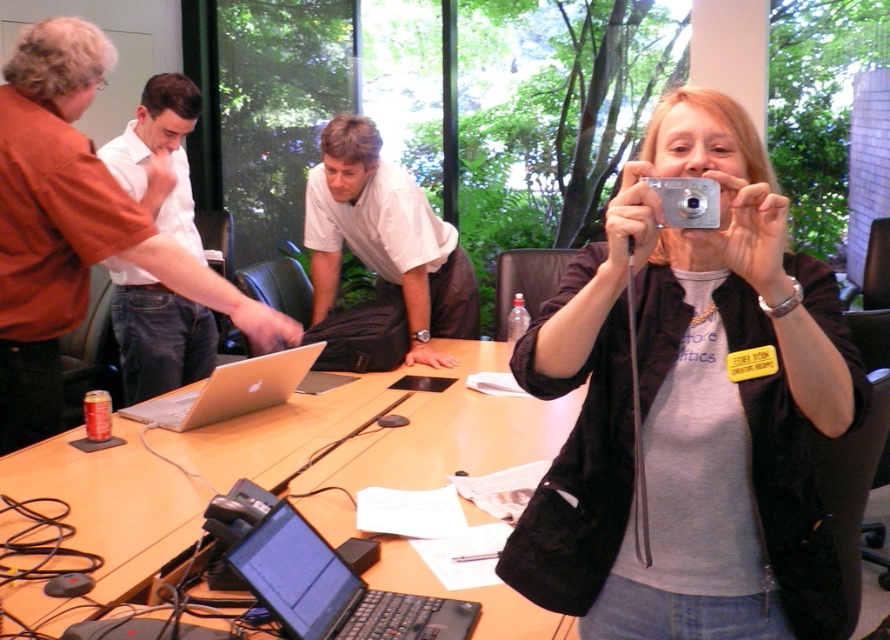
You are standing at the origin point of the coordinate system in this image. The coordinate system has its origin at the bottom left corner of the image. You need to move towards the black plastic laptop at lower center. What direction should you move in to reach it?

The black plastic laptop at lower center is located at point (333, 588). Since the coordinate system has its origin at the bottom left corner, moving towards the right and slightly upwards will lead you to the black plastic laptop at lower center.

You are standing in the room and want to place a 4.5 feet long laptop charger on the wooden table at center. Can you fit the charger on the table without it hanging over the edge?

The wooden table at center is 4.29 feet from viewer. The distance from the viewer does not indicate the table size. Therefore, it is unclear if the 4.5 feet long charger can fit without hanging over the edge based on the provided information.

You are a delivery robot with a package that needs to be placed on the wooden table at center. The robot has a maximum reach of 1.2 meters. Can the robot place the package on the table without moving closer?

The wooden table at center and camera are 1.31 meters apart from each other. Since the robot can only reach 1.2 meters, it cannot place the package on the wooden table at center without moving closer.